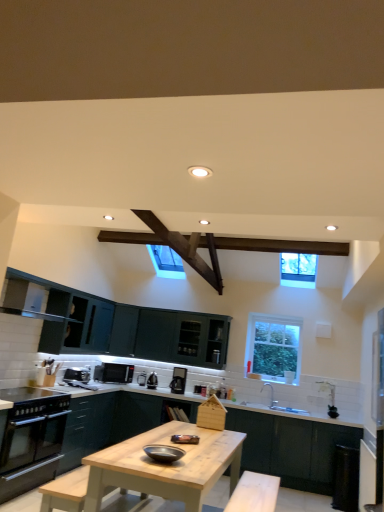
Where is `vacant space underneath shiny metallic bowl at center, the 2th appliance in the right-to-left sequence (from a real-world perspective)`? Image resolution: width=384 pixels, height=512 pixels. vacant space underneath shiny metallic bowl at center, the 2th appliance in the right-to-left sequence (from a real-world perspective) is located at coordinates (173, 458).